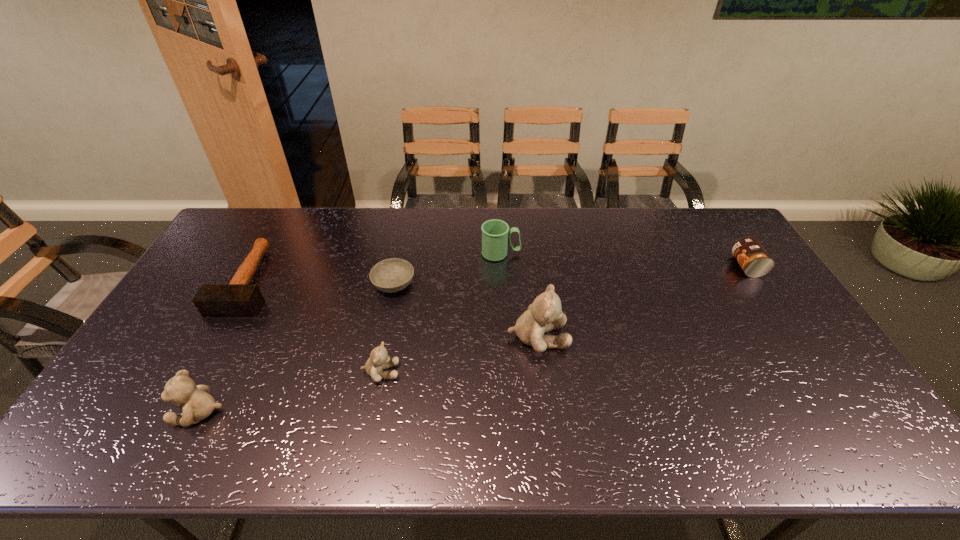
The image size is (960, 540). Identify the location of the closest teddy bear to the nearest object. (379, 359).

Locate an element on the screen. Image resolution: width=960 pixels, height=540 pixels. teddy bear that is the second nearest to the rightmost teddy bear is located at coordinates (197, 404).

Find the location of a particular element. The image size is (960, 540). free location that satisfies the following two spatial constraints: 1. on the side of the mug with the handle; 2. on the hammer head face of the mallet is located at coordinates (502, 280).

This screenshot has width=960, height=540. Find the location of `vacant space that satisfies the following two spatial constraints: 1. on the front label of the rightmost object; 2. on the hammer head face of the second shortest object`. vacant space that satisfies the following two spatial constraints: 1. on the front label of the rightmost object; 2. on the hammer head face of the second shortest object is located at coordinates [756, 280].

The height and width of the screenshot is (540, 960). Find the location of `free space that satisfies the following two spatial constraints: 1. on the front label of the can; 2. on the front side of the shortest object`. free space that satisfies the following two spatial constraints: 1. on the front label of the can; 2. on the front side of the shortest object is located at coordinates (758, 285).